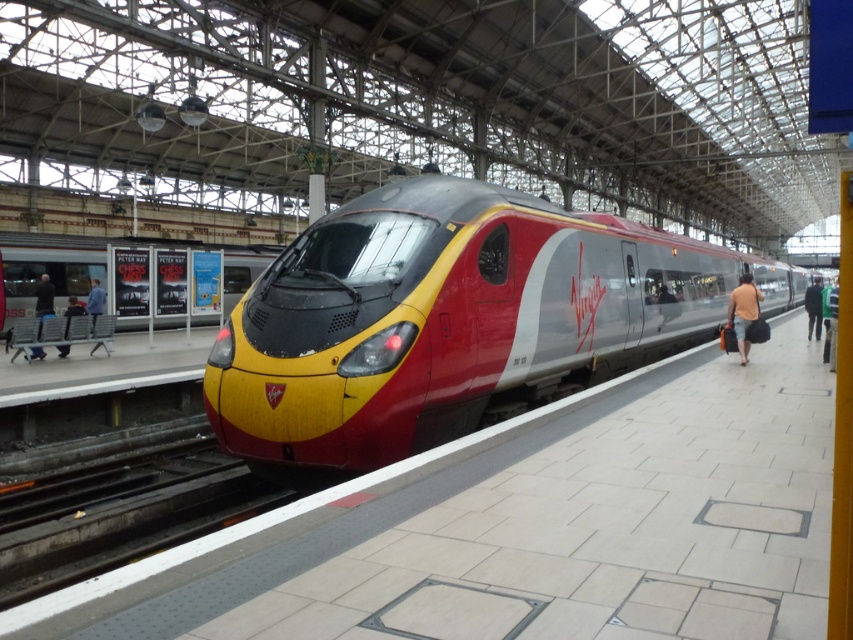
You are a passenger standing on the platform. You see the metallic silver train at center and the dark blue jeans at lower left. Which object is closer to the edge of the platform marked by the white safety line?

The dark blue jeans at lower left are closer to the edge of the platform marked by the white safety line because the metallic silver train at center is positioned on the right side of them, meaning the jeans are closer to the edge.

You are standing on the platform and want to take a photo of the metallic silver train at center. If your camera can focus on objects up to 20 feet away, will you be able to capture a clear photo?

The metallic silver train at center is 20.18 feet away from the camera. Since the camera can focus up to 20 feet, it cannot focus beyond that distance. Therefore, the photo may not be clear.

Looking at this image, you are a passenger standing on the platform and see the yellow glossy train at center and the green fabric jacket at right. Which object is closer to you?

The yellow glossy train at center is closer to you than the green fabric jacket at right.